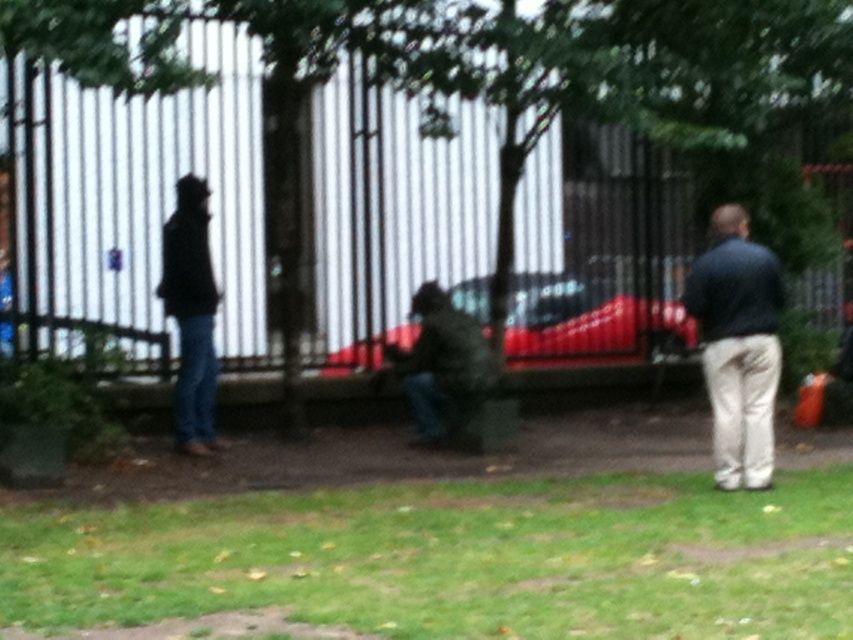
Based on the photo, you are standing in the park and see the shiny red car at center and the black matte jacket at left. Which object is positioned higher from the ground?

The black matte jacket at left is positioned higher from the ground since the shiny red car at center is located below it.

You are a delivery person with a cart that is 2 meters wide. You need to move from the shiny red car at center to the black matte jacket at left. Is there enough space between them for your cart to pass through?

The distance between the shiny red car at center and the black matte jacket at left is 3.81 meters. Since the cart is 2 meters wide, there is sufficient space for it to pass through the 3.81 meters gap between them.